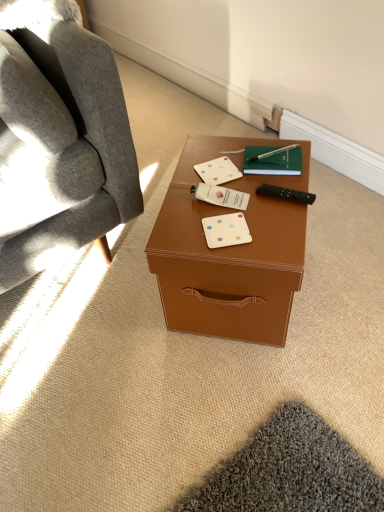
Find the location of a particular element. The height and width of the screenshot is (512, 384). free location to the right of brown leather desk at center is located at coordinates (338, 269).